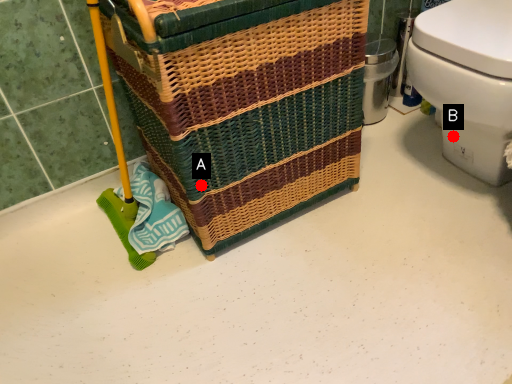
Question: Two points are circled on the image, labeled by A and B beside each circle. Which point is closer to the camera?

Choices:
 (A) A is closer
 (B) B is closer

Answer: (A)